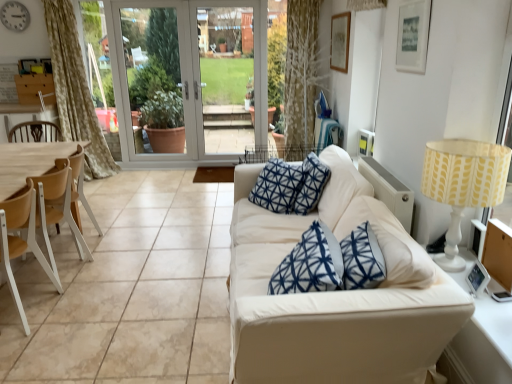
This screenshot has height=384, width=512. What are the coordinates of `silver metallic clock at upper left` in the screenshot? It's located at (15, 16).

Measure the distance between white glass screen door at center, the 2th screen door when ordered from right to left, and camera.

17.13 feet.

In order to face white glass screen door at center, positioned as the first screen door in left-to-right order, should I rotate leftwards or rightwards?

To align with it, rotate left about 9.252°.

In order to click on silver metallic clock at upper left in this screenshot , I will do `click(15, 16)`.

This screenshot has height=384, width=512. Identify the location of clock above the light wood/woodenchair at left, arranged as the 2th chair when viewed from the front (from a real-world perspective). (15, 16).

Looking at their sizes, would you say light wood/woodenchair at left, arranged as the 1th chair when viewed from the back, is wider or thinner than silver metallic clock at upper left?

In the image, light wood/woodenchair at left, arranged as the 1th chair when viewed from the back, appears to be wider than silver metallic clock at upper left.

From a real-world perspective, between light wood/woodenchair at left, arranged as the 1th chair when viewed from the back, and silver metallic clock at upper left, who is vertically lower?

light wood/woodenchair at left, arranged as the 1th chair when viewed from the back.

Based on the photo, is light wood/woodenchair at left, arranged as the 2th chair when viewed from the front, positioned far away from silver metallic clock at upper left?

Yes, light wood/woodenchair at left, arranged as the 2th chair when viewed from the front, is far from silver metallic clock at upper left.

Is silver metallic clock at upper left facing towards white fabric couch at center?

No, silver metallic clock at upper left is not oriented towards white fabric couch at center.

Between silver metallic clock at upper left and white fabric couch at center, which one has more height?

With more height is white fabric couch at center.

Which object is positioned more to the left, silver metallic clock at upper left or white fabric couch at center?

silver metallic clock at upper left is more to the left.

Is silver metallic clock at upper left not inside white fabric couch at center?

Indeed, silver metallic clock at upper left is completely outside white fabric couch at center.

Based on the photo, is silver metallic clock at upper left aimed at wooden at left, arranged as the first chair when viewed from the front?

No, silver metallic clock at upper left does not turn towards wooden at left, arranged as the first chair when viewed from the front.

From the image's perspective, is silver metallic clock at upper left located above wooden at left, arranged as the first chair when viewed from the front?

Yes.

Is silver metallic clock at upper left behind wooden at left, arranged as the first chair when viewed from the front?

Yes, it is.

Is silver metallic clock at upper left outside of white glass screen door at center, the 2th screen door when ordered from right to left?

silver metallic clock at upper left lies outside white glass screen door at center, the 2th screen door when ordered from right to left,'s area.

From the image's perspective, is silver metallic clock at upper left positioned above or below white glass screen door at center, the 2th screen door when ordered from right to left?

silver metallic clock at upper left is above white glass screen door at center, the 2th screen door when ordered from right to left.

Measure the distance between silver metallic clock at upper left and white glass screen door at center, the 2th screen door when ordered from right to left.

silver metallic clock at upper left and white glass screen door at center, the 2th screen door when ordered from right to left, are 6.69 feet apart.

Considering the sizes of objects silver metallic clock at upper left and white glass screen door at center, positioned as the first screen door in left-to-right order, in the image provided, who is wider, silver metallic clock at upper left or white glass screen door at center, positioned as the first screen door in left-to-right order,?

white glass screen door at center, positioned as the first screen door in left-to-right order.

Is wooden at left, arranged as the first chair when viewed from the front, wider than silver metallic clock at upper left?

Yes, wooden at left, arranged as the first chair when viewed from the front, is wider than silver metallic clock at upper left.

What's the angular difference between wooden at left, the second chair in the back-to-front sequence, and silver metallic clock at upper left's facing directions?

There is a 93.1-degree angle between the facing directions of wooden at left, the second chair in the back-to-front sequence, and silver metallic clock at upper left.

Which of these two, wooden at left, arranged as the first chair when viewed from the front, or silver metallic clock at upper left, stands taller?

wooden at left, arranged as the first chair when viewed from the front, is taller.

Does wooden at left, the second chair in the back-to-front sequence, contain silver metallic clock at upper left?

No.

Can you tell me how much white glass screen door at center, the 2th screen door when ordered from right to left, and wooden at left, the second chair in the back-to-front sequence, differ in facing direction?

The angular difference between white glass screen door at center, the 2th screen door when ordered from right to left, and wooden at left, the second chair in the back-to-front sequence, is 93.3 degrees.

How much distance is there between white glass screen door at center, the 2th screen door when ordered from right to left, and wooden at left, the second chair in the back-to-front sequence?

They are 3.54 meters apart.

Is point (266, 100) closer to viewer compared to point (9, 210)?

No, (266, 100) is further to viewer.

Could you tell me if white glass screen door at center, the 2th screen door when ordered from right to left, is turned towards wooden at left, arranged as the first chair when viewed from the front?

Yes, white glass screen door at center, the 2th screen door when ordered from right to left, is aimed at wooden at left, arranged as the first chair when viewed from the front.

Which is more to the left, yellow fabric lampshade at right or wooden at left, arranged as the first chair when viewed from the front?

Positioned to the left is wooden at left, arranged as the first chair when viewed from the front.

What's the angular difference between yellow fabric lampshade at right and wooden at left, arranged as the first chair when viewed from the front,'s facing directions?

The angle between the facing direction of yellow fabric lampshade at right and the facing direction of wooden at left, arranged as the first chair when viewed from the front, is 3.84 degrees.

Is point (441, 256) farther from viewer compared to point (17, 294)?

No, (441, 256) is in front of (17, 294).

This screenshot has width=512, height=384. What are the coordinates of `clock that appears above the light wood/woodenchair at left, arranged as the 2th chair when viewed from the front (from a real-world perspective)` in the screenshot? It's located at tap(15, 16).

I want to click on studio couch below the silver metallic clock at upper left (from the image's perspective), so click(335, 294).

Based on the photo, from the image, which object appears to be farther from silver metallic clock at upper left, clear glass door at center, which is the second screen door from left to right, or light brown wood armchair at left?

clear glass door at center, which is the second screen door from left to right, is positioned further to the anchor silver metallic clock at upper left.

Based on their spatial positions, is yellow fabric lampshade at right or white glass screen door at center, the 2th screen door when ordered from right to left, closer to light wood/woodenchair at left, arranged as the 2th chair when viewed from the front?

Among the two, yellow fabric lampshade at right is located nearer to light wood/woodenchair at left, arranged as the 2th chair when viewed from the front.

Estimate the real-world distances between objects in this image. Which object is closer to silver metallic clock at upper left, white glass screen door at center, the 2th screen door when ordered from right to left, or wooden at left, arranged as the first chair when viewed from the front?

white glass screen door at center, the 2th screen door when ordered from right to left, lies closer to silver metallic clock at upper left than the other object.

Which object lies further to the anchor point white fabric couch at center, light wood/woodenchair at left, arranged as the 1th chair when viewed from the back, or matte white picture frame at upper right?

The object further to white fabric couch at center is light wood/woodenchair at left, arranged as the 1th chair when viewed from the back.

Looking at the image, which one is located closer to wooden at left, arranged as the first chair when viewed from the front, white fabric couch at center or matte white picture frame at upper right?

white fabric couch at center lies closer to wooden at left, arranged as the first chair when viewed from the front, than the other object.

When comparing their distances from matte white picture frame at upper right, does light wood/woodenchair at left, arranged as the 2th chair when viewed from the front, or clear glass door at center, which is the second screen door from left to right, seem further?

The object further to matte white picture frame at upper right is clear glass door at center, which is the second screen door from left to right.

Estimate the real-world distances between objects in this image. Which object is closer to silver metallic clock at upper left, clear glass door at center, the first screen door in the right-to-left sequence, or white glass screen door at center, the 2th screen door when ordered from right to left?

white glass screen door at center, the 2th screen door when ordered from right to left, lies closer to silver metallic clock at upper left than the other object.

Based on their spatial positions, is yellow fabric lampshade at right or light brown wood armchair at left further from silver metallic clock at upper left?

yellow fabric lampshade at right is further to silver metallic clock at upper left.

Locate an element on the screen. picture frame situated between light wood/woodenchair at left, arranged as the 2th chair when viewed from the front, and yellow fabric lampshade at right from left to right is located at coordinates (413, 36).

I want to click on chair between silver metallic clock at upper left and wooden at left, the second chair in the back-to-front sequence, in the vertical direction, so coord(59,203).

This screenshot has width=512, height=384. I want to click on picture frame between yellow fabric lampshade at right and white glass screen door at center, positioned as the first screen door in left-to-right order, along the z-axis, so click(x=413, y=36).

Locate an element on the screen. Image resolution: width=512 pixels, height=384 pixels. screen door between light brown wood armchair at left and white glass screen door at center, the 2th screen door when ordered from right to left, from front to back is located at coordinates (230, 79).